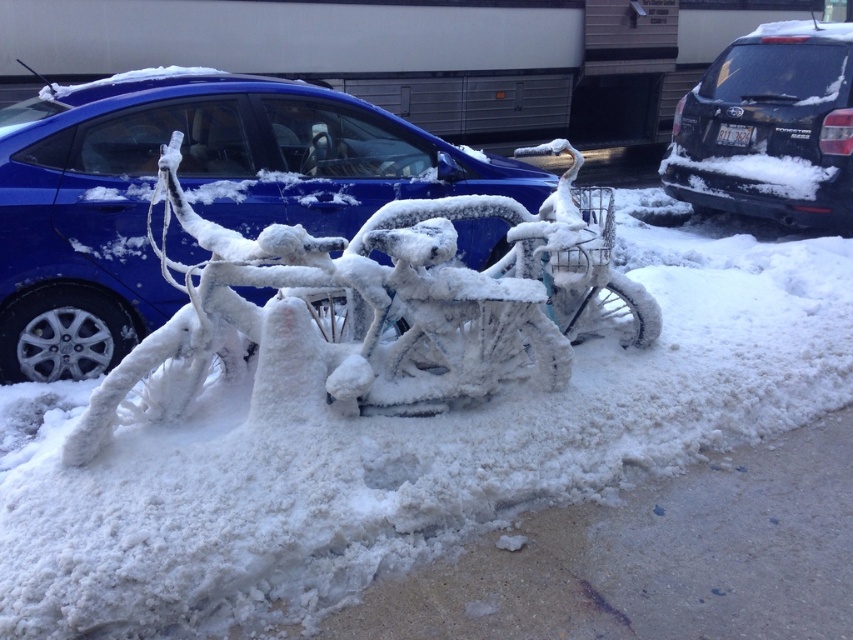
Question: Which point is closer to the camera taking this photo?

Choices:
 (A) (718, 129)
 (B) (183, 614)

Answer: (B)

Question: Is white frosty bicycle at center behind matte blue car at center?

Choices:
 (A) yes
 (B) no

Answer: (B)

Question: Does white frosty bicycle at center appear over matte blue car at center?

Choices:
 (A) no
 (B) yes

Answer: (A)

Question: Which object appears farthest from the camera in this image?

Choices:
 (A) matte blue car at center
 (B) black matte suv at upper right

Answer: (B)

Question: Which of the following is the closest to the observer?

Choices:
 (A) (387, 483)
 (B) (120, 241)

Answer: (A)

Question: From the image, what is the correct spatial relationship of white frosty bicycle at center in relation to black matte suv at upper right?

Choices:
 (A) above
 (B) below

Answer: (B)